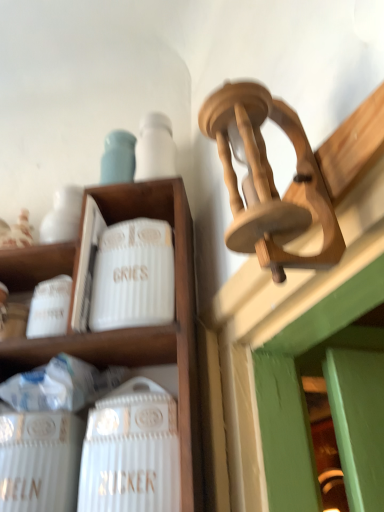
The height and width of the screenshot is (512, 384). Find the location of `white ceramic wine bottle at lower left`. white ceramic wine bottle at lower left is located at coordinates (131, 451).

Measure the distance between white ceramic wine bottle at lower left and camera.

white ceramic wine bottle at lower left and camera are 17.87 inches apart.

What do you see at coordinates (133, 276) in the screenshot?
I see `white ribbed ceramic canister at center-left` at bounding box center [133, 276].

Measure the distance between white ceramic canister at upper left and camera.

They are 17.94 inches apart.

Locate an element on the screen. The height and width of the screenshot is (512, 384). white ceramic wine bottle at lower left is located at coordinates (131, 451).

In the scene shown: How far apart are white ceramic wine bottle at lower left and white ceramic canister at upper left?

white ceramic wine bottle at lower left is 12.19 centimeters from white ceramic canister at upper left.

Where is `wine bottle located in front of the white ceramic canister at upper left`? Image resolution: width=384 pixels, height=512 pixels. wine bottle located in front of the white ceramic canister at upper left is located at coordinates (131, 451).

Is the position of white ceramic wine bottle at lower left more distant than that of white ceramic canister at upper left?

No, white ceramic wine bottle at lower left is in front of white ceramic canister at upper left.

Is there a large distance between white ceramic wine bottle at lower left and white ceramic canister at upper left?

They are positioned close to each other.

Is white ceramic canister at upper left positioned in front of white ribbed ceramic canister at center-left?

Yes, it is.

Between white ceramic canister at upper left and white ribbed ceramic canister at center-left, which one has larger size?

With larger size is white ceramic canister at upper left.

Considering the relative sizes of white ceramic canister at upper left and white ribbed ceramic canister at center-left in the image provided, is white ceramic canister at upper left shorter than white ribbed ceramic canister at center-left?

In fact, white ceramic canister at upper left may be taller than white ribbed ceramic canister at center-left.

Is white ribbed ceramic canister at center-left with white ceramic canister at upper left?

Yes, the surface of white ribbed ceramic canister at center-left is in contact with white ceramic canister at upper left.

What's the angular difference between white ribbed ceramic canister at center-left and white ceramic canister at upper left's facing directions?

white ribbed ceramic canister at center-left and white ceramic canister at upper left are facing 3.22 degrees away from each other.

Measure the distance from white ribbed ceramic canister at center-left to white ceramic canister at upper left.

white ribbed ceramic canister at center-left and white ceramic canister at upper left are 2.78 inches apart.

In the image, there is a white ceramic canister at upper left. Identify the location of pottery above it (from the image's perspective). 133,276.

The width and height of the screenshot is (384, 512). Find the location of `wine bottle that appears below the white ribbed ceramic canister at center-left (from the image's perspective)`. wine bottle that appears below the white ribbed ceramic canister at center-left (from the image's perspective) is located at coordinates (131, 451).

Is white ribbed ceramic canister at center-left bigger than white ceramic wine bottle at lower left?

Actually, white ribbed ceramic canister at center-left might be smaller than white ceramic wine bottle at lower left.

From a real-world perspective, which object stands above the other?

In real-world perspective, white ribbed ceramic canister at center-left is above.

Which of these two, white ribbed ceramic canister at center-left or white ceramic wine bottle at lower left, is thinner?

With smaller width is white ceramic wine bottle at lower left.

You are a GUI agent. You are given a task and a screenshot of the screen. Output one action in this format:
    pyautogui.click(x=<x>, y=<y>)
    Task: Click on the shelf above the white ceramic wine bottle at lower left (from the image's perspective)
    
    Given the screenshot: What is the action you would take?
    pyautogui.click(x=125, y=328)

Is white ceramic canister at upper left oriented towards white ceramic wine bottle at lower left?

Yes, white ceramic canister at upper left is facing white ceramic wine bottle at lower left.

Considering the positions of objects white ceramic canister at upper left and white ceramic wine bottle at lower left in the image provided, who is more to the left, white ceramic canister at upper left or white ceramic wine bottle at lower left?

white ceramic canister at upper left is more to the left.

Is white ceramic canister at upper left positioned in front of white ceramic wine bottle at lower left?

No, white ceramic canister at upper left is further to the viewer.

Considering the sizes of objects white ceramic wine bottle at lower left and white ribbed ceramic canister at center-left in the image provided, who is bigger, white ceramic wine bottle at lower left or white ribbed ceramic canister at center-left?

white ceramic wine bottle at lower left is bigger.

Can you tell me how much white ceramic wine bottle at lower left and white ribbed ceramic canister at center-left differ in facing direction?

4.93e-05 degrees.

Which of these two, white ceramic wine bottle at lower left or white ribbed ceramic canister at center-left, stands taller?

Standing taller between the two is white ceramic wine bottle at lower left.

Considering the positions of objects white ceramic wine bottle at lower left and white ribbed ceramic canister at center-left in the image provided, who is more to the left, white ceramic wine bottle at lower left or white ribbed ceramic canister at center-left?

Positioned to the left is white ribbed ceramic canister at center-left.

I want to click on wine bottle that appears on the right of white ceramic canister at upper left, so click(131, 451).

Find the location of a particular element. shelf beneath the white ribbed ceramic canister at center-left (from a real-world perspective) is located at coordinates [125, 328].

Considering their positions, is white ceramic canister at upper left positioned closer to white ribbed ceramic canister at center-left than white ceramic wine bottle at lower left?

white ceramic canister at upper left lies closer to white ribbed ceramic canister at center-left than the other object.

When comparing their distances from white ceramic wine bottle at lower left, does white ceramic canister at upper left or white ribbed ceramic canister at center-left seem further?

The object further to white ceramic wine bottle at lower left is white ribbed ceramic canister at center-left.

Which object lies further to the anchor point white ceramic canister at upper left, white ceramic wine bottle at lower left or white ribbed ceramic canister at center-left?

white ceramic wine bottle at lower left.

Based on their spatial positions, is white ribbed ceramic canister at center-left or white ceramic canister at upper left further from white ceramic wine bottle at lower left?

Based on the image, white ribbed ceramic canister at center-left appears to be further to white ceramic wine bottle at lower left.

Based on the photo, from the image, which object appears to be nearer to white ribbed ceramic canister at center-left, white ceramic wine bottle at lower left or white ceramic canister at upper left?

Based on the image, white ceramic canister at upper left appears to be nearer to white ribbed ceramic canister at center-left.

When comparing their distances from white ceramic canister at upper left, does white ribbed ceramic canister at center-left or white ceramic wine bottle at lower left seem further?

white ceramic wine bottle at lower left is further to white ceramic canister at upper left.

The image size is (384, 512). Find the location of `shelf between white ribbed ceramic canister at center-left and white ceramic wine bottle at lower left vertically`. shelf between white ribbed ceramic canister at center-left and white ceramic wine bottle at lower left vertically is located at coordinates (125, 328).